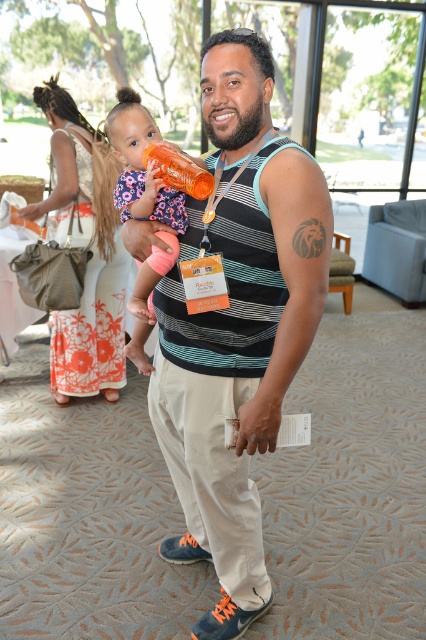
Question: Is striped tank top at center smaller than floral fabric dress at center?

Choices:
 (A) yes
 (B) no

Answer: (B)

Question: Is floral fabric dress at center in front of orange plastic bottle at center?

Choices:
 (A) yes
 (B) no

Answer: (B)

Question: Does striped tank top at center appear on the right side of floral fabric dress at center?

Choices:
 (A) yes
 (B) no

Answer: (A)

Question: Estimate the real-world distances between objects in this image. Which object is closer to the orange translucent bottle at center?

Choices:
 (A) orange plastic bottle at center
 (B) floral fabric dress at center
 (C) striped tank top at center

Answer: (A)

Question: Which object appears closest to the camera in this image?

Choices:
 (A) floral fabric dress at center
 (B) striped tank top at center
 (C) orange plastic bottle at center

Answer: (B)

Question: Among these points, which one is farthest from the camera?

Choices:
 (A) (137, 323)
 (B) (154, 150)
 (C) (80, 362)

Answer: (C)